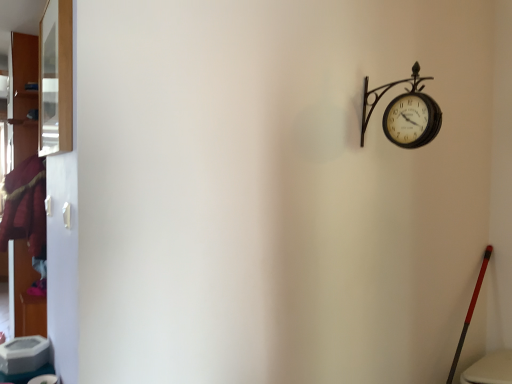
Question: From the image's perspective, is velvet maroon coat at left under clear glass window at upper left?

Choices:
 (A) yes
 (B) no

Answer: (A)

Question: Are velvet maroon coat at left and clear glass window at upper left located far from each other?

Choices:
 (A) no
 (B) yes

Answer: (B)

Question: Is clear glass window at upper left inside velvet maroon coat at left?

Choices:
 (A) yes
 (B) no

Answer: (B)

Question: Is velvet maroon coat at left wider than clear glass window at upper left?

Choices:
 (A) yes
 (B) no

Answer: (A)

Question: Is velvet maroon coat at left at the left side of clear glass window at upper left?

Choices:
 (A) no
 (B) yes

Answer: (B)

Question: Is the position of velvet maroon coat at left less distant than that of clear glass window at upper left?

Choices:
 (A) no
 (B) yes

Answer: (A)

Question: Is clear glass window at upper left positioned in front of metallic black clock at upper right?

Choices:
 (A) yes
 (B) no

Answer: (A)

Question: From the image's perspective, is clear glass window at upper left above metallic black clock at upper right?

Choices:
 (A) yes
 (B) no

Answer: (A)

Question: Is clear glass window at upper left completely or partially outside of metallic black clock at upper right?

Choices:
 (A) no
 (B) yes

Answer: (B)

Question: Would you say metallic black clock at upper right is part of clear glass window at upper left's contents?

Choices:
 (A) yes
 (B) no

Answer: (B)

Question: Could you tell me if clear glass window at upper left is turned towards metallic black clock at upper right?

Choices:
 (A) yes
 (B) no

Answer: (B)

Question: Considering the relative positions of clear glass window at upper left and metallic black clock at upper right in the image provided, is clear glass window at upper left to the left of metallic black clock at upper right from the viewer's perspective?

Choices:
 (A) yes
 (B) no

Answer: (A)

Question: Can velvet maroon coat at left be found inside clear glass window at upper left?

Choices:
 (A) no
 (B) yes

Answer: (A)